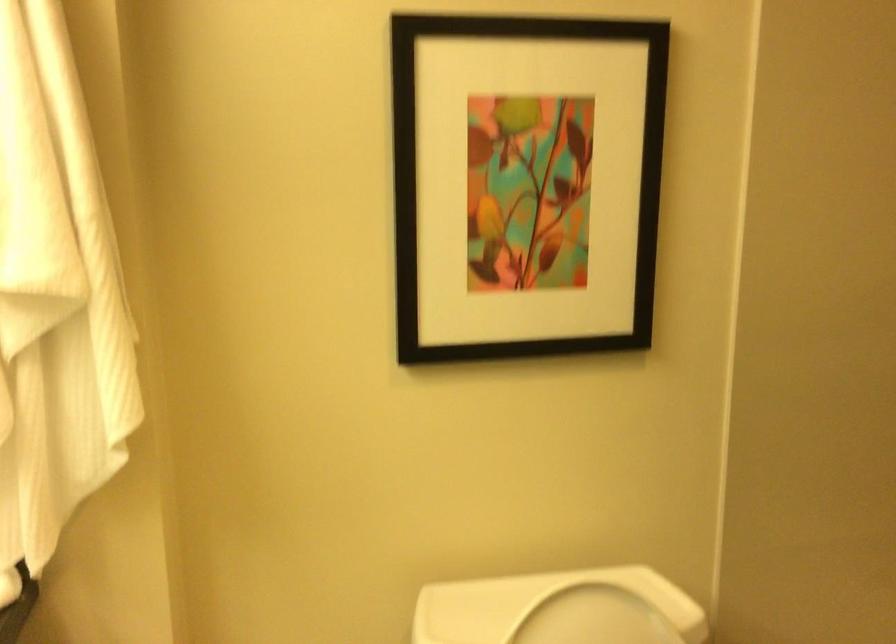
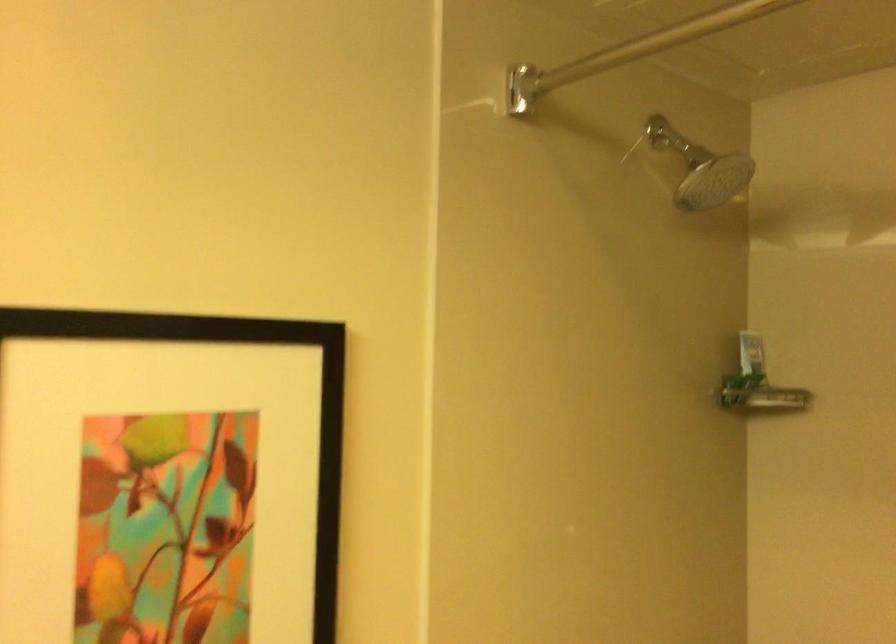
Question: The images are taken continuously from a first-person perspective. In which direction is your viewpoint rotating?

Choices:
 (A) Left
 (B) Right
 (C) Up
 (D) Down

Answer: (B)